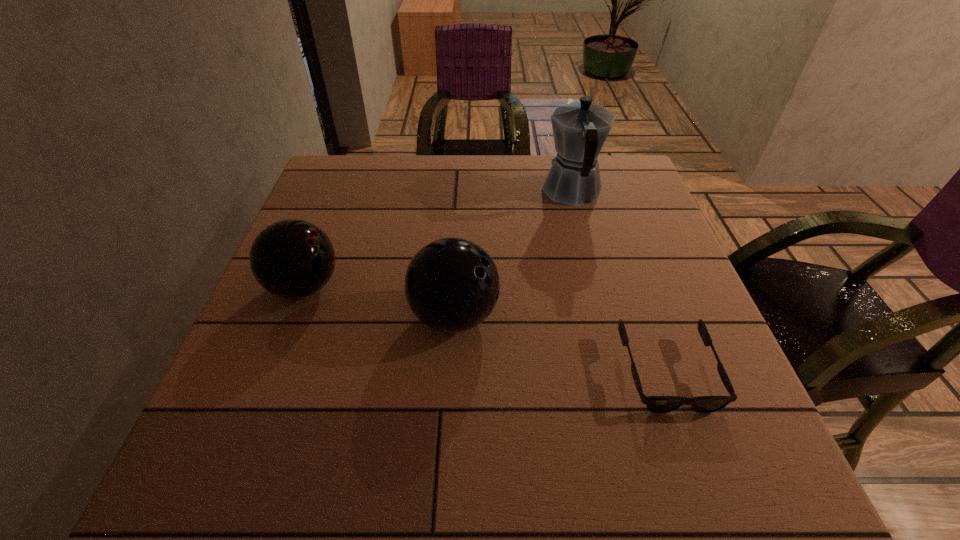
The height and width of the screenshot is (540, 960). I want to click on object that is at the left edge, so click(292, 259).

In order to click on coffeepot that is at the right edge in this screenshot , I will do `click(580, 128)`.

Where is `sunglasses positioned at the right edge`? The image size is (960, 540). sunglasses positioned at the right edge is located at coordinates (657, 404).

Locate an element on the screen. This screenshot has height=540, width=960. object situated at the far right corner is located at coordinates (580, 128).

Locate an element on the screen. Image resolution: width=960 pixels, height=540 pixels. vacant position at the far edge of the desktop is located at coordinates click(x=490, y=182).

At what (x,y) coordinates should I click in order to perform the action: click on vacant space at the near edge of the desktop. Please return your answer as a coordinate pair (x, y). Image resolution: width=960 pixels, height=540 pixels. Looking at the image, I should click on (325, 441).

Where is `vacant space at the left edge of the desktop`? vacant space at the left edge of the desktop is located at coordinates (323, 213).

Find the location of a particular element. This screenshot has width=960, height=540. free space at the right edge of the desktop is located at coordinates (705, 368).

In the image, there is a desktop. Identify the location of vacant space at the far left corner. (368, 202).

This screenshot has width=960, height=540. What are the coordinates of `vacant space at the near left corner of the desktop` in the screenshot? It's located at (192, 455).